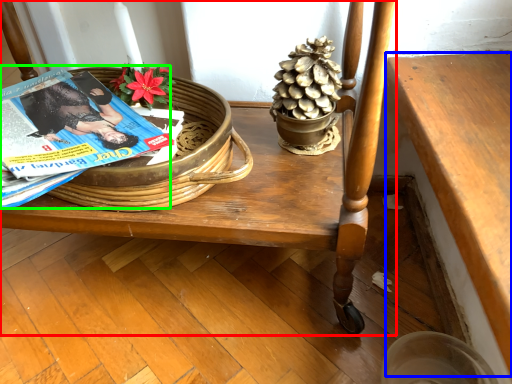
Question: Which object is the farthest from furniture (highlighted by a red box)? Choose among these: table (highlighted by a blue box) or magazine (highlighted by a green box).

Choices:
 (A) table
 (B) magazine

Answer: (B)